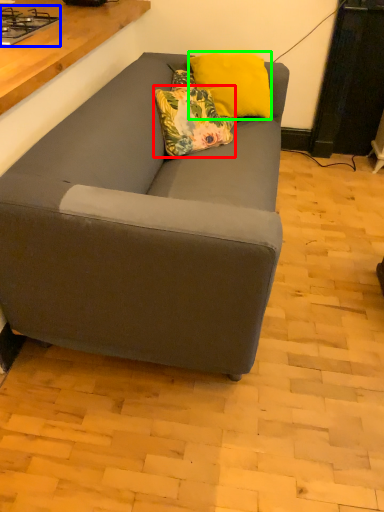
Question: Which is nearer to the pillow (highlighted by a red box)? gas stove (highlighted by a blue box) or pillow (highlighted by a green box).

Choices:
 (A) gas stove
 (B) pillow

Answer: (B)